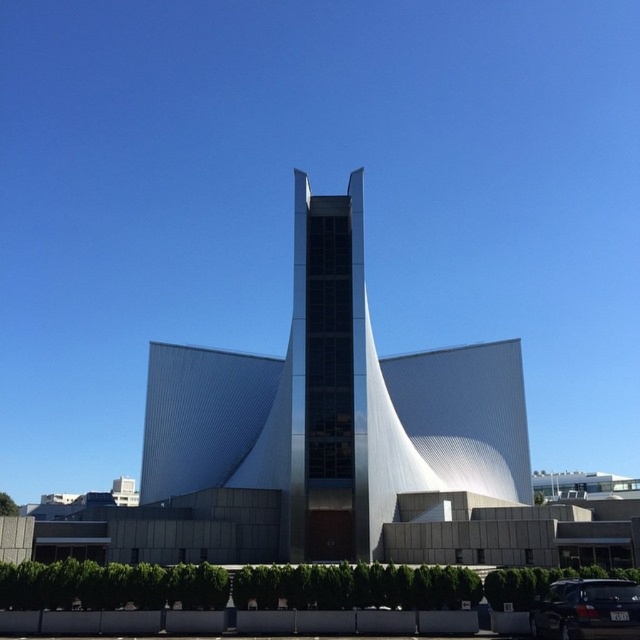
In the scene shown: You are standing at the entrance of the modern architectural structure and want to take a photo of the metallic silver tower at center. To ensure the tower is centered in your photo, where should you position yourself relative to the tower?

The metallic silver tower at center is located at point (333, 406), so you should position yourself directly in front of the tower at that coordinate to ensure it is centered in your photo.